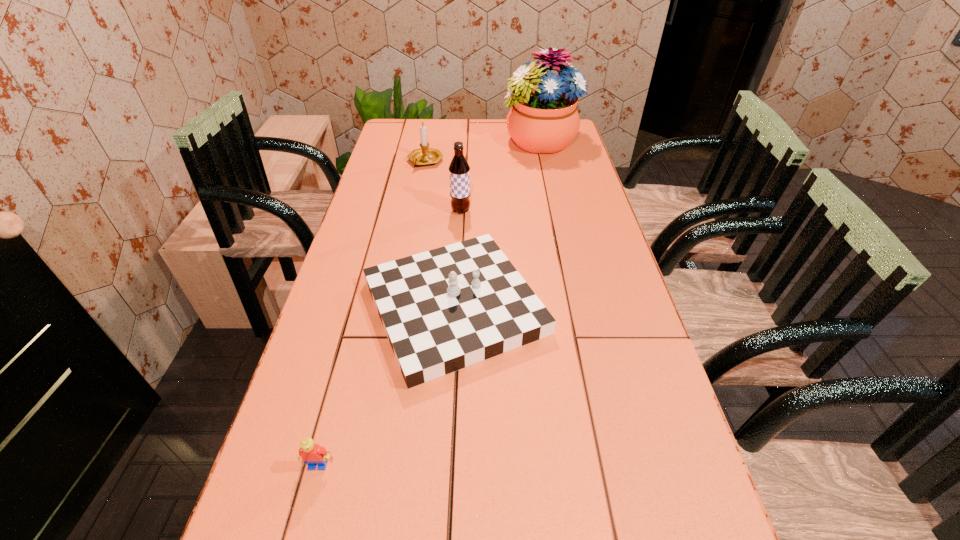
I want to click on flower arrangement, so click(x=543, y=119).

Find the location of a particular element. the third farthest object is located at coordinates (459, 170).

The width and height of the screenshot is (960, 540). In order to click on root beer in this screenshot , I will do `click(459, 170)`.

At what (x,y) coordinates should I click in order to perform the action: click on candle holder. Please return your answer as a coordinate pair (x, y). Image resolution: width=960 pixels, height=540 pixels. Looking at the image, I should click on tap(424, 156).

Where is `the fourth farthest object`? The image size is (960, 540). the fourth farthest object is located at coordinates (445, 309).

This screenshot has height=540, width=960. I want to click on checkerboard, so click(x=445, y=309).

Identify the location of Lego. (313, 455).

Where is `the shortest object`? Image resolution: width=960 pixels, height=540 pixels. the shortest object is located at coordinates (313, 455).

Locate an element on the screen. vacant space located on the front of the tallest object is located at coordinates (552, 199).

You are a GUI agent. You are given a task and a screenshot of the screen. Output one action in this format:
    pyautogui.click(x=<x>, y=<y>)
    Task: Click on the vacant point located on the front of the third farthest object
    This screenshot has height=540, width=960.
    Given the screenshot: What is the action you would take?
    pyautogui.click(x=459, y=245)